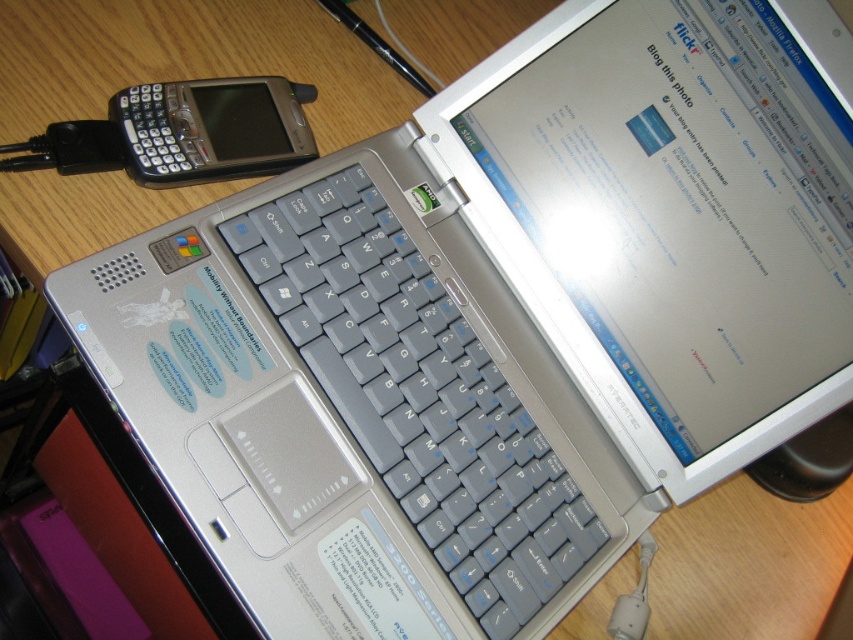
You are setting up a workspace and need to place both the gray plastic keyboard at center and the black plastic smartphone at upper left on a desk. Given their sizes, which one should you place first to ensure they both fit comfortably?

Since the gray plastic keyboard at center is larger in size than the black plastic smartphone at upper left, you should place the gray plastic keyboard at center first to ensure there is enough space left for the smaller black plastic smartphone at upper left.

You need to place both the gray plastic keyboard at center and the black plastic smartphone at upper left into a rectangular box. The box can only fit items that are narrower than 20 cm. Based on their widths, can both items fit inside the box?

The gray plastic keyboard at center might be wider than black plastic smartphone at upper left. Since the keyboard might be wider than 20 cm, it might not fit in the box. The smartphone is narrower than the keyboard, so it might still fit. Therefore, both items might not fit inside the box.

You are sitting at the desk and want to reach both the gray plastic keyboard at center and the black plastic smartphone at upper left. Which one will you need to move your hand less to reach?

The gray plastic keyboard at center is closer to the viewer, so you will need to move your hand less to reach it compared to the black plastic smartphone at upper left.